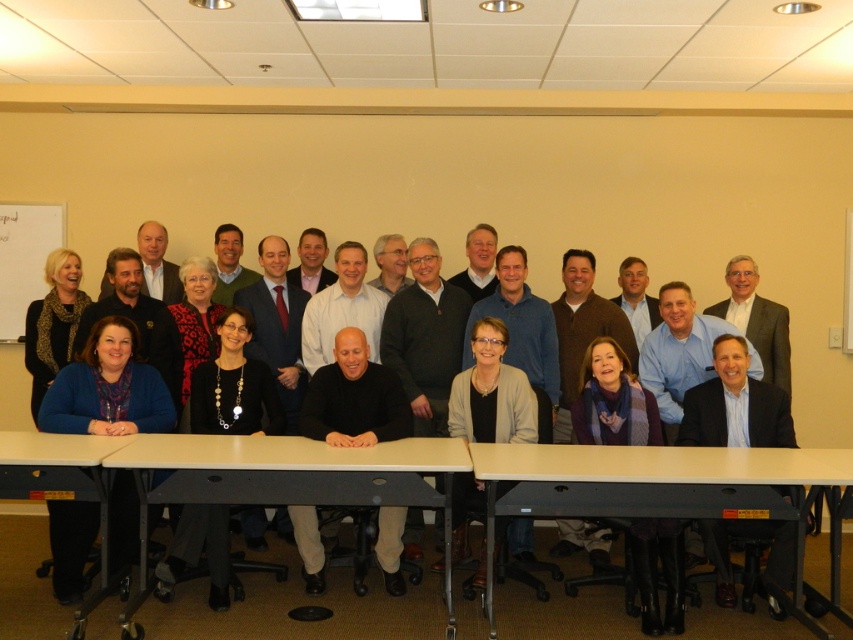
Is white plastic table at center wider than black sweater at center?

Correct, the width of white plastic table at center exceeds that of black sweater at center.

Between white plastic table at center and black sweater at center, which one appears on the right side from the viewer's perspective?

black sweater at center

Does point (270, 474) come in front of point (186, 381)?

That is True.

You are a GUI agent. You are given a task and a screenshot of the screen. Output one action in this format:
    pyautogui.click(x=<x>, y=<y>)
    Task: Click on the white plastic table at center
    The image size is (853, 640).
    Given the screenshot: What is the action you would take?
    (291, 476)

Which is more to the right, black sweater at center or light brown wood table at lower left?

Positioned to the right is black sweater at center.

Does black sweater at center appear under light brown wood table at lower left?

Actually, black sweater at center is above light brown wood table at lower left.

What do you see at coordinates (195, 401) in the screenshot? The height and width of the screenshot is (640, 853). I see `black sweater at center` at bounding box center [195, 401].

I want to click on black sweater at center, so click(x=195, y=401).

Can you confirm if light brown wood table at lower left is shorter than whiteboard at upper left?

Indeed, light brown wood table at lower left has a lesser height compared to whiteboard at upper left.

Who is positioned more to the right, light brown wood table at lower left or whiteboard at upper left?

Positioned to the right is light brown wood table at lower left.

Is point (27, 467) positioned in front of point (59, 243)?

Yes, it is.

Where is `light brown wood table at lower left`? The height and width of the screenshot is (640, 853). light brown wood table at lower left is located at coordinates (62, 483).